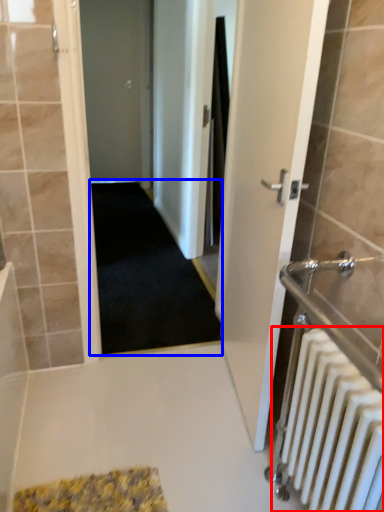
Question: Which object is closer to the camera taking this photo, radiator (highlighted by a red box) or doormat (highlighted by a blue box)?

Choices:
 (A) radiator
 (B) doormat

Answer: (A)